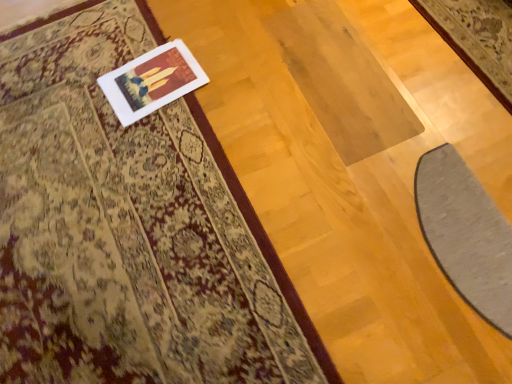
The height and width of the screenshot is (384, 512). I want to click on free space behind gray soft mat at lower right, so click(x=376, y=125).